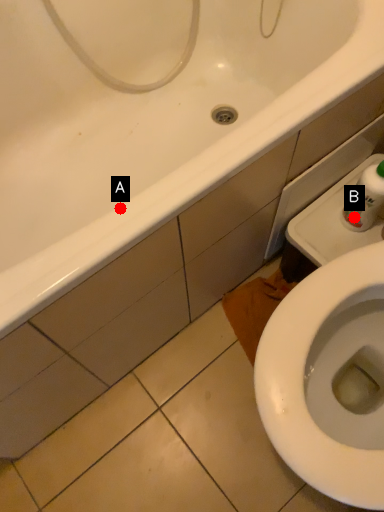
Question: Two points are circled on the image, labeled by A and B beside each circle. Which point is farther to the camera?

Choices:
 (A) A is further
 (B) B is further

Answer: (B)